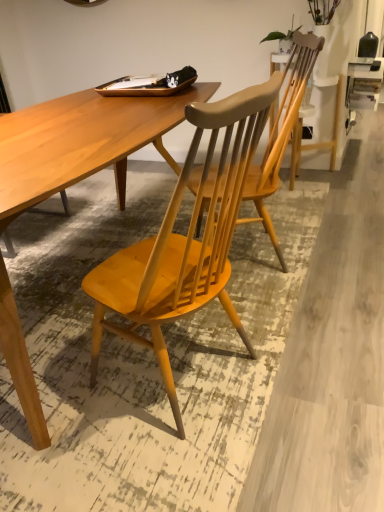
Describe the element at coordinates (281, 133) in the screenshot. I see `matte wood chair at center` at that location.

At what (x,y) coordinates should I click in order to perform the action: click on matte wood chair at center. Please return your answer as a coordinate pair (x, y). The image size is (384, 512). Looking at the image, I should click on (281, 133).

This screenshot has width=384, height=512. What do you see at coordinates (82, 142) in the screenshot? I see `light brown wood desk at center` at bounding box center [82, 142].

Find the location of a particular element. light brown wood desk at center is located at coordinates (82, 142).

I want to click on matte wood chair at center, so click(x=281, y=133).

Is light brown wood desk at center at the left side of matte wood chair at center?

Correct, you'll find light brown wood desk at center to the left of matte wood chair at center.

Is light brown wood desk at center further to the viewer compared to matte wood chair at center?

No, light brown wood desk at center is closer to the viewer.

Does point (32, 180) lie behind point (252, 182)?

No, it is not.

From the image's perspective, is light brown wood desk at center above or below matte wood chair at center?

light brown wood desk at center is below matte wood chair at center.

From a real-world perspective, which is physically below, light brown wood desk at center or matte wood chair at center?

From a 3D spatial view, light brown wood desk at center is below.

Is light brown wood desk at center wider or thinner than matte wood chair at center?

In the image, light brown wood desk at center appears to be wider than matte wood chair at center.

Considering the relative sizes of light brown wood desk at center and matte wood chair at center in the image provided, is light brown wood desk at center taller than matte wood chair at center?

No, light brown wood desk at center is not taller than matte wood chair at center.

In terms of size, does light brown wood desk at center appear bigger or smaller than matte wood chair at center?

light brown wood desk at center is bigger than matte wood chair at center.

Is matte wood chair at center completely or partially inside light brown wood desk at center?

That's incorrect, matte wood chair at center is not inside light brown wood desk at center.

Is light brown wood desk at center not near matte wood chair at center?

No, light brown wood desk at center is not far away from matte wood chair at center.

Is light brown wood desk at center oriented away from matte wood chair at center?

light brown wood desk at center is not turned away from matte wood chair at center.

How distant is light brown wood desk at center from matte wood chair at center?

A distance of 52.96 centimeters exists between light brown wood desk at center and matte wood chair at center.

You are a GUI agent. You are given a task and a screenshot of the screen. Output one action in this format:
    pyautogui.click(x=<x>, y=<y>)
    Task: Click on the desk below the matte wood chair at center (from the image's perspective)
    This screenshot has height=512, width=384.
    Given the screenshot: What is the action you would take?
    pyautogui.click(x=82, y=142)

Consider the image. Does matte wood chair at center appear on the right side of light brown wood desk at center?

Yes, matte wood chair at center is to the right of light brown wood desk at center.

Which object is closer to the camera taking this photo, matte wood chair at center or light brown wood desk at center?

Positioned in front is light brown wood desk at center.

Is point (210, 179) closer or farther from the camera than point (207, 90)?

Point (210, 179) appears to be closer to the viewer than point (207, 90).

From the image's perspective, which is above, matte wood chair at center or light brown wood desk at center?

matte wood chair at center, from the image's perspective.

From a real-world perspective, which object rests below the other?

light brown wood desk at center.

Is matte wood chair at center wider than light brown wood desk at center?

In fact, matte wood chair at center might be narrower than light brown wood desk at center.

Which of these two, matte wood chair at center or light brown wood desk at center, stands taller?

Standing taller between the two is matte wood chair at center.

Which of these two, matte wood chair at center or light brown wood desk at center, is smaller?

With smaller size is matte wood chair at center.

Is matte wood chair at center situated inside light brown wood desk at center or outside?

matte wood chair at center is not inside light brown wood desk at center, it's outside.

Is matte wood chair at center next to light brown wood desk at center?

No, matte wood chair at center is not in contact with light brown wood desk at center.

Is matte wood chair at center oriented towards light brown wood desk at center?

Yes, matte wood chair at center is aimed at light brown wood desk at center.

What's the angular difference between matte wood chair at center and light brown wood desk at center's facing directions?

There is a 156-degree angle between the facing directions of matte wood chair at center and light brown wood desk at center.

How distant is matte wood chair at center from light brown wood desk at center?

The distance of matte wood chair at center from light brown wood desk at center is 20.85 inches.

Find the location of a particular element. The image size is (384, 512). chair above the light brown wood desk at center (from a real-world perspective) is located at coordinates (281, 133).

The width and height of the screenshot is (384, 512). What are the coordinates of `chair that appears on the right of light brown wood desk at center` in the screenshot? It's located at (281, 133).

In order to click on desk located underneath the matte wood chair at center (from a real-world perspective) in this screenshot , I will do `click(82, 142)`.